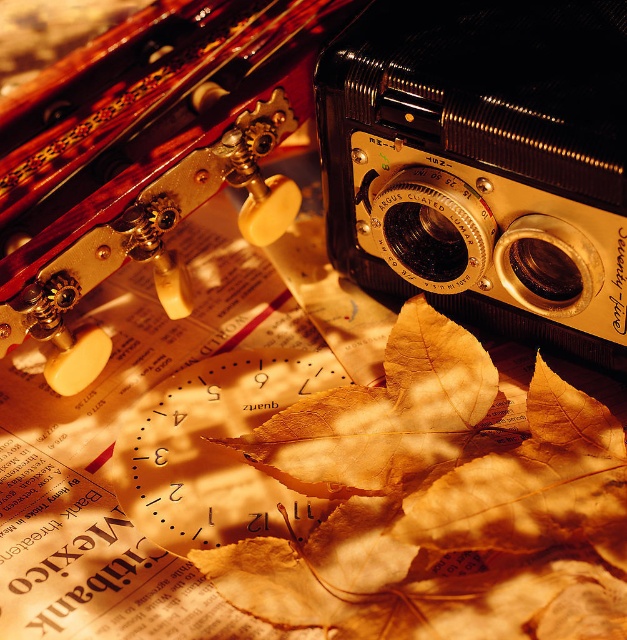
Who is more distant from viewer, (372, 204) or (345, 412)?

The point (345, 412) is more distant.

Does gold metallic camera at center have a smaller size compared to golden dried leaf at center?

Actually, gold metallic camera at center might be larger than golden dried leaf at center.

This screenshot has height=640, width=627. Describe the element at coordinates (483, 163) in the screenshot. I see `gold metallic camera at center` at that location.

Locate an element on the screen. The height and width of the screenshot is (640, 627). gold metallic camera at center is located at coordinates (483, 163).